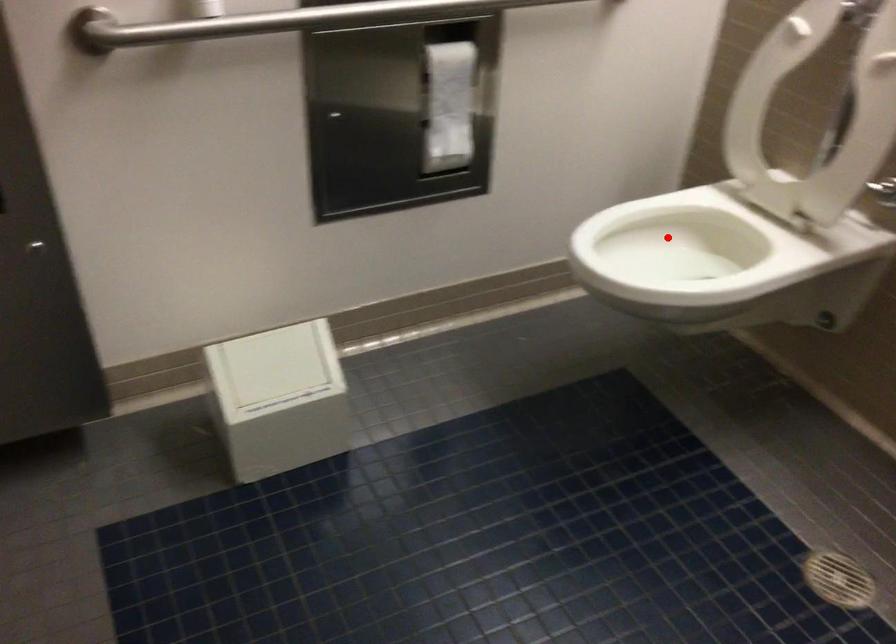
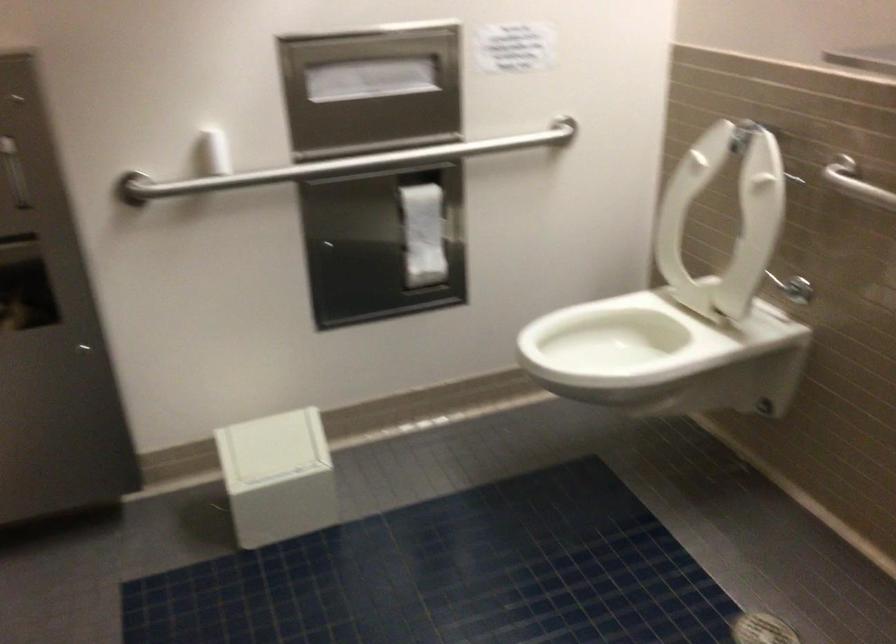
Question: I am providing you with two images of the same scene from different viewpoints. In image1, a red point is highlighted. Considering the same 3D point in image2, which of the following is correct?

Choices:
 (A) It is closer
 (B) It is farther

Answer: (B)